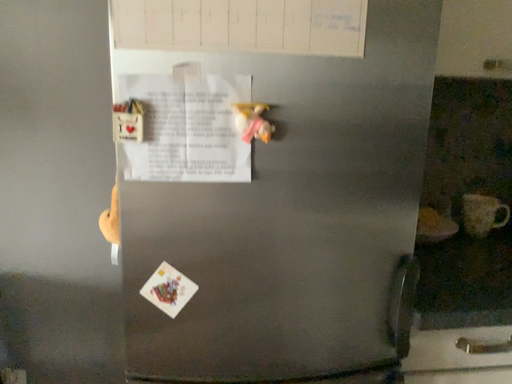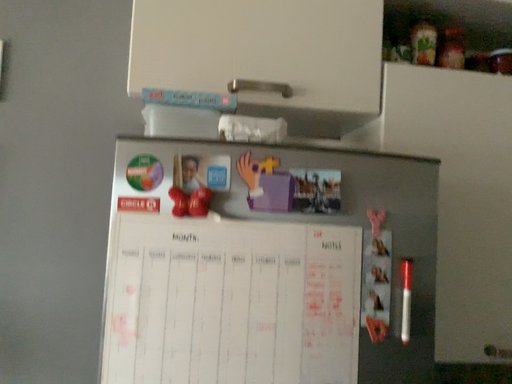
Question: How did the camera likely rotate when shooting the video?

Choices:
 (A) rotated upward
 (B) rotated downward

Answer: (A)